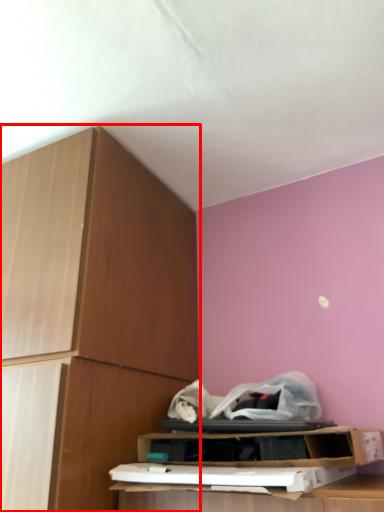
Question: Considering the relative positions of cabinetry (annotated by the red box) and shelf in the image provided, where is cabinetry (annotated by the red box) located with respect to the staircase?

Choices:
 (A) right
 (B) left

Answer: (B)